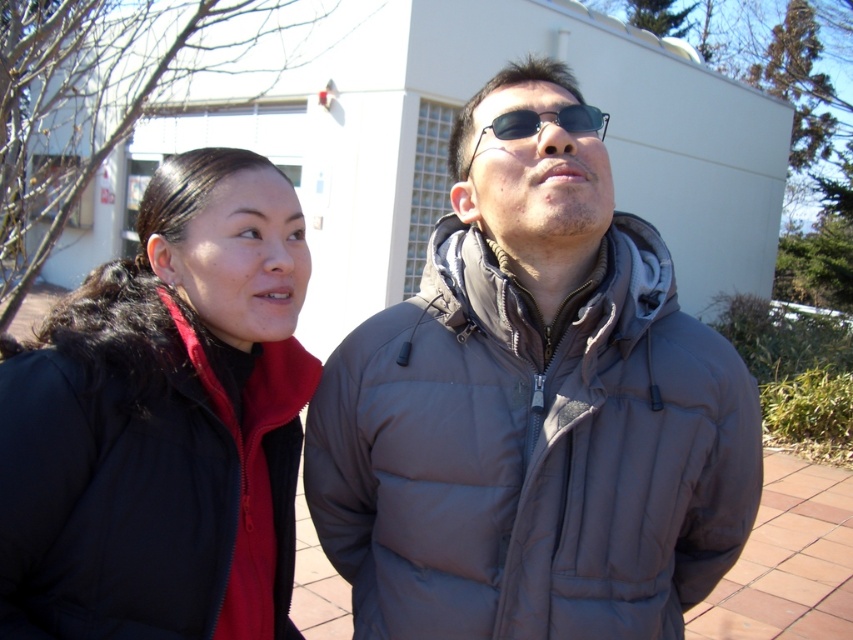
You are standing at the point with coordinates point (521, 131) and want to walk towards the point with coordinates point (465, 440). Based on the scene description, will you be moving towards the building or away from it?

Since point (465, 440) is in front of point (521, 131), moving towards it would mean you are moving away from the building in the background.

You are a photographer trying to capture a clear shot of the gray puffy jacket at center and the black plastic sunglasses at center. Since you want both items to be visible in the frame, would you adjust your camera to focus on the closer object or the farther one?

Since the gray puffy jacket at center is taller than the black plastic sunglasses at center, you should focus on the closer object to ensure both are in focus. However, the description only mentions their height, not distance, so this question might be based on incorrect assumptions. Please check the spatial details again.